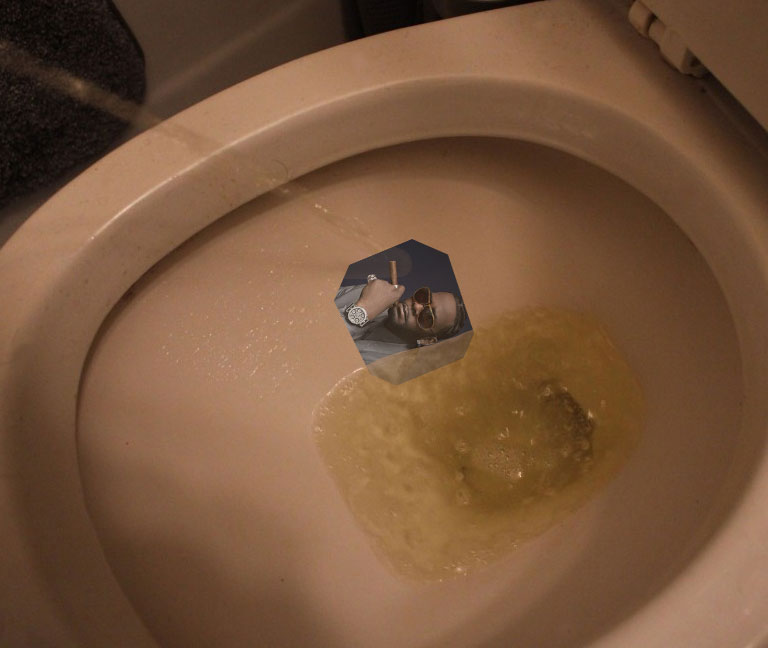
At what (x,y) coordinates should I click in order to perform the action: click on toilet bowl. Please return your answer as a coordinate pair (x, y). Looking at the image, I should click on (156, 432).